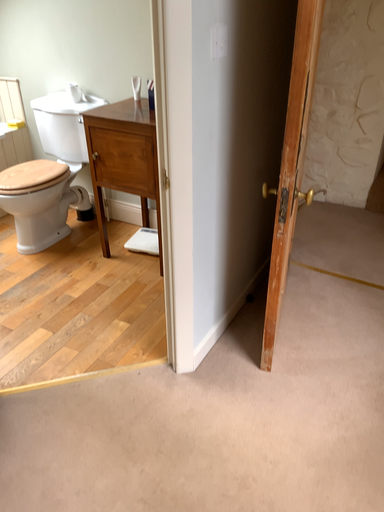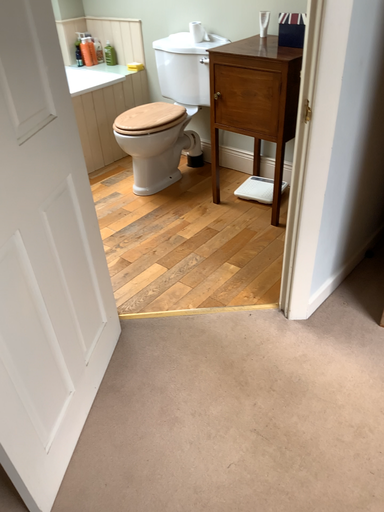
Question: Which way did the camera rotate in the video?

Choices:
 (A) rotated left
 (B) rotated right

Answer: (A)